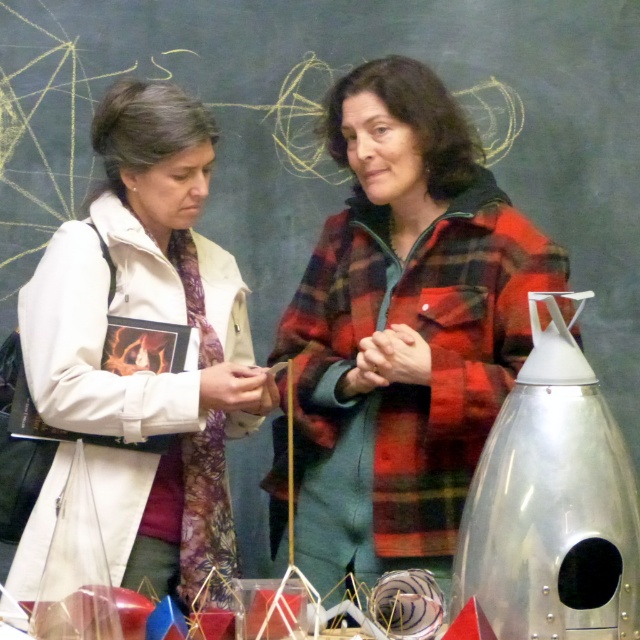
Does red plaid jacket at center appear on the right side of white matte jacket at center?

Indeed, red plaid jacket at center is positioned on the right side of white matte jacket at center.

In order to click on red plaid jacket at center in this screenshot , I will do `click(403, 330)`.

At what (x,y) coordinates should I click in order to perform the action: click on red plaid jacket at center. Please return your answer as a coordinate pair (x, y). The height and width of the screenshot is (640, 640). Looking at the image, I should click on (403, 330).